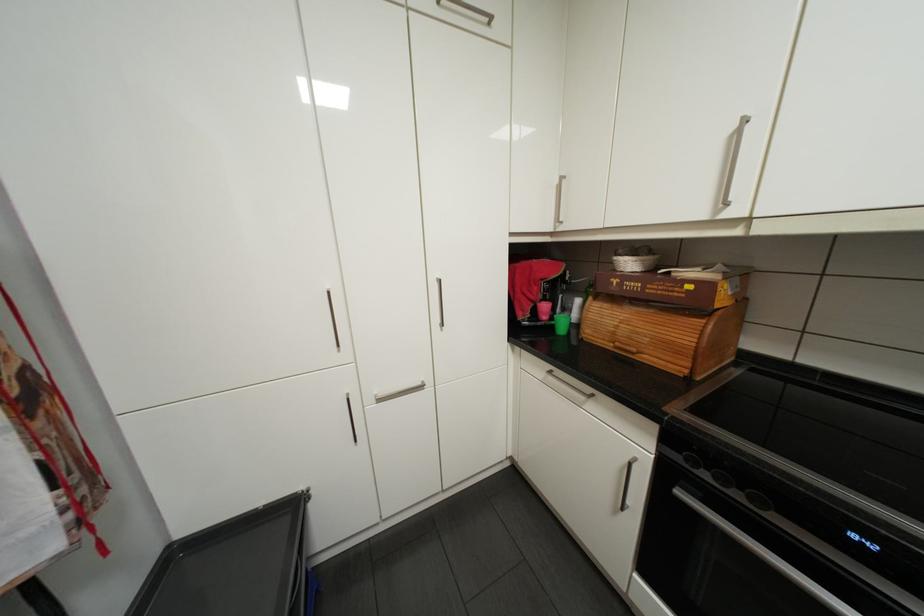
Where is `small wicker basket`? small wicker basket is located at coordinates (635, 257).